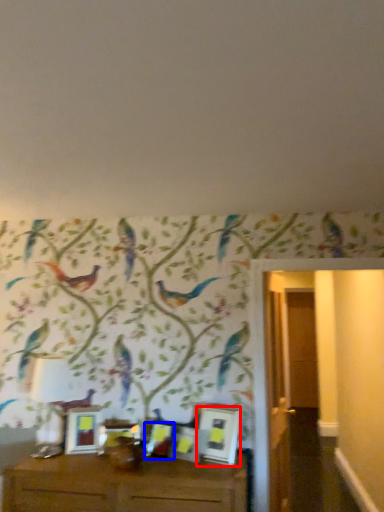
Question: Which point is closer to the camera, picture frame (highlighted by a red box) or picture frame (highlighted by a blue box)?

Choices:
 (A) picture frame
 (B) picture frame

Answer: (A)